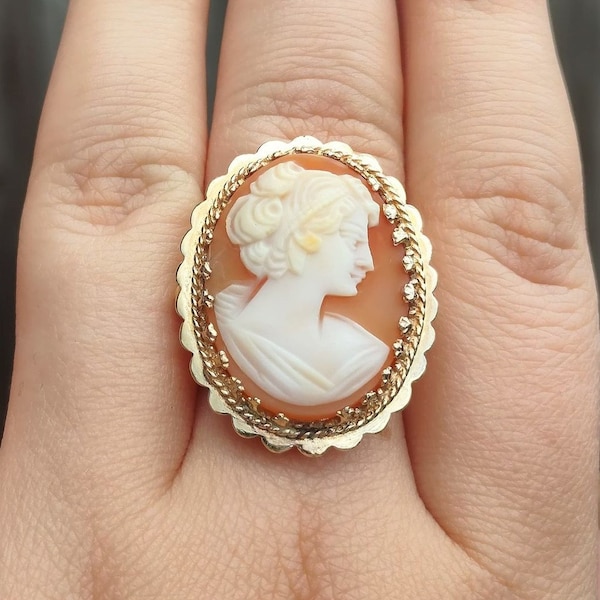
At what (x,y) coordinates should I click in order to perform the action: click on gold border of pendant. Please return your answer as a coordinate pair (x, y). This screenshot has height=600, width=600. Looking at the image, I should click on (246, 160).